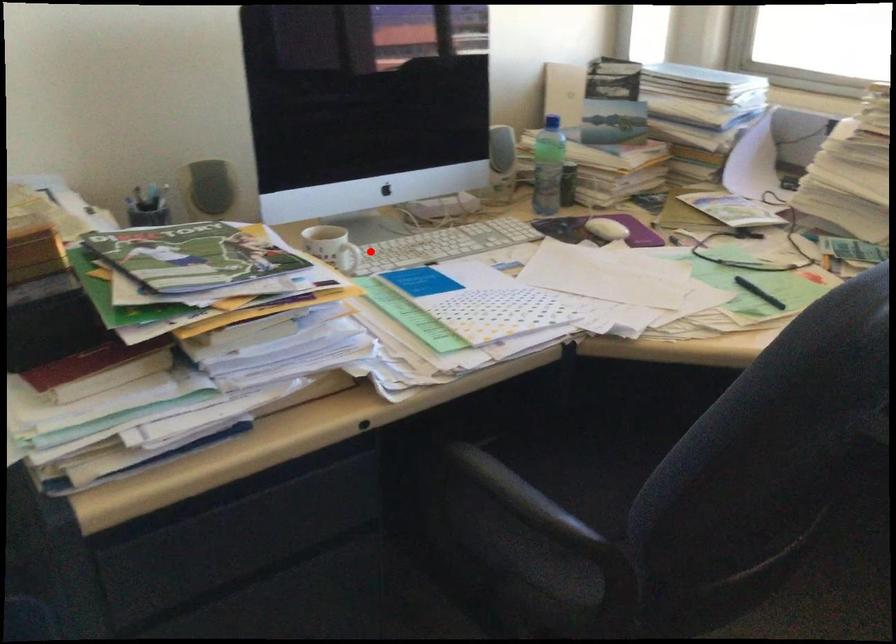
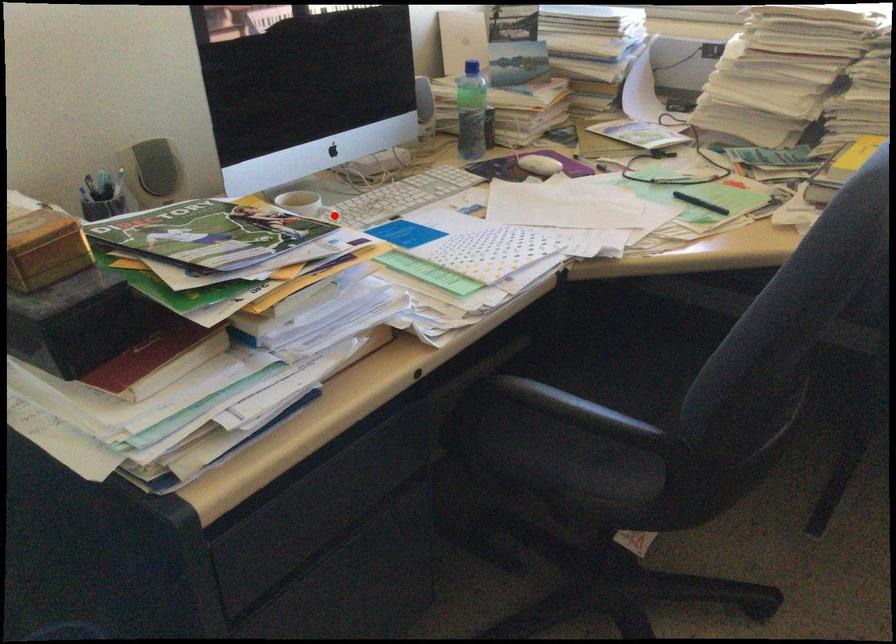
I am providing you with two images of the same scene from different viewpoints. A red point is marked on the first image and another point is marked on the second image. Is the marked point in image1 the same physical position as the marked point in image2?

Yes